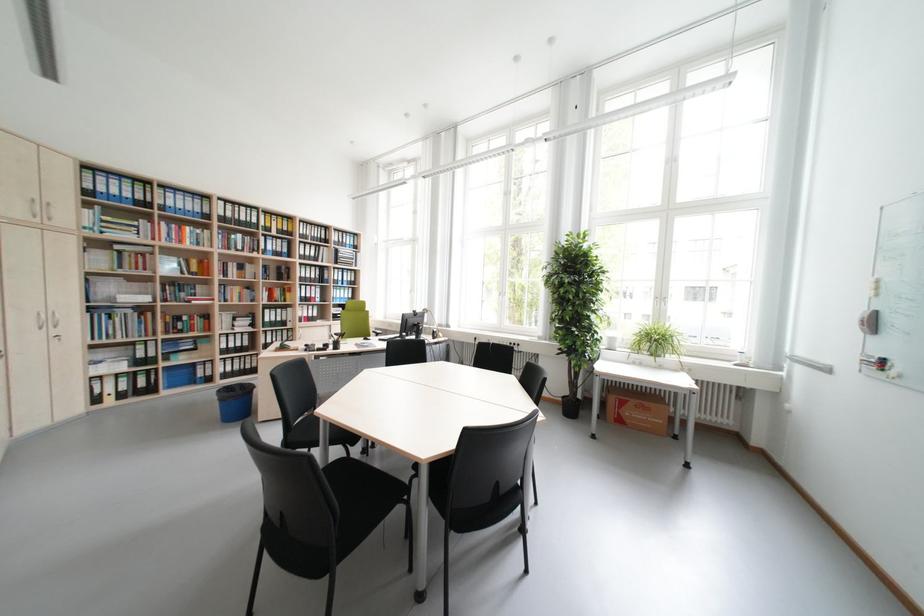
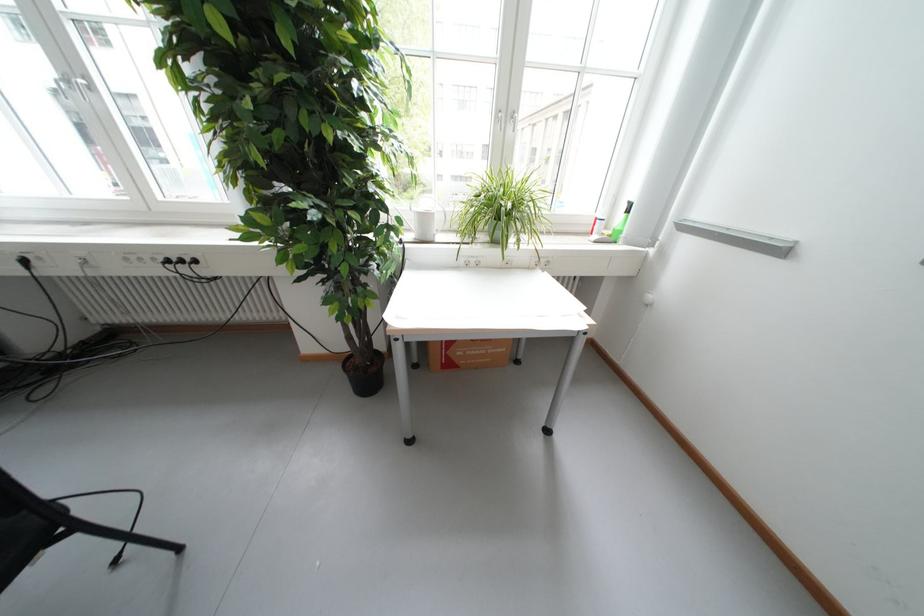
The point at (520, 345) is marked in the first image. Where is the corresponding point in the second image?

(177, 262)